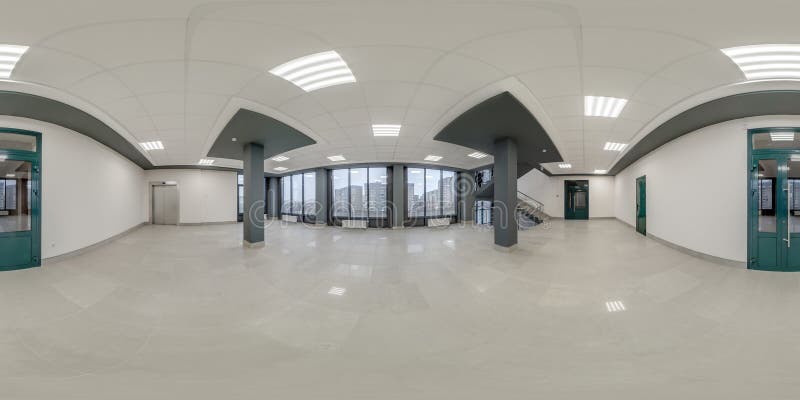
Where is `elevator`? This screenshot has width=800, height=400. elevator is located at coordinates (156, 205).